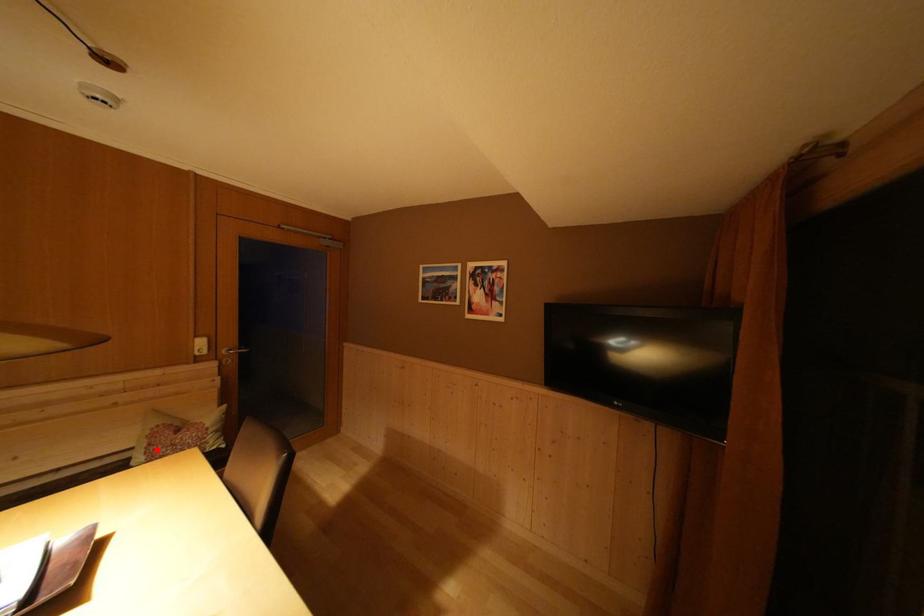
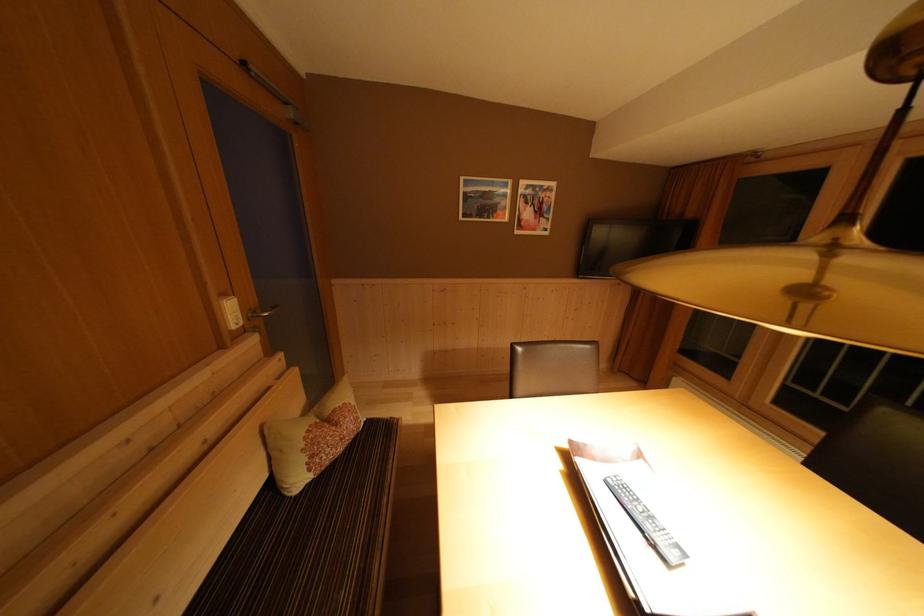
Question: I am providing you with two images of the same scene from different viewpoints. In image1, a red point is highlighted. Considering the same 3D point in image2, which of the following is correct?

Choices:
 (A) It is closer
 (B) It is farther

Answer: (B)